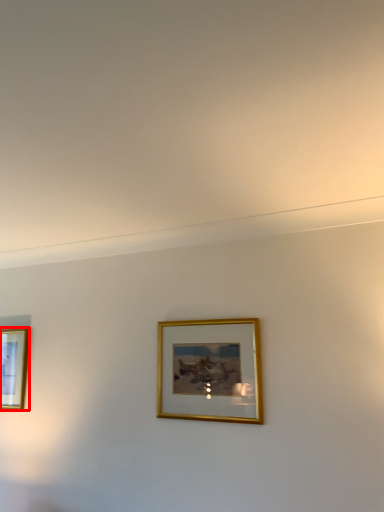
Question: In this image, where is picture frame (annotated by the red box) located relative to picture frame?

Choices:
 (A) right
 (B) left

Answer: (B)